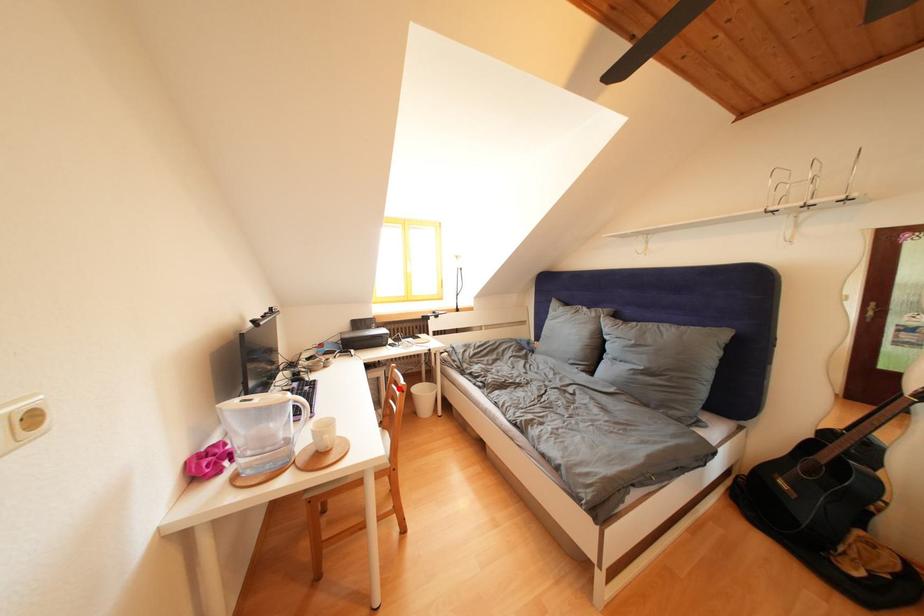
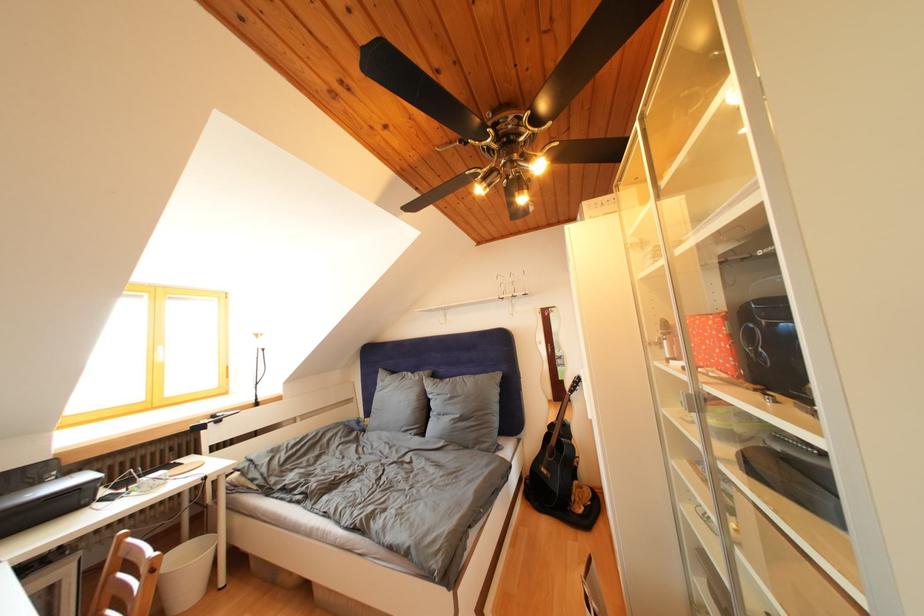
The point at the highlighted location is marked in the first image. Where is the corresponding point in the second image?

(119, 578)